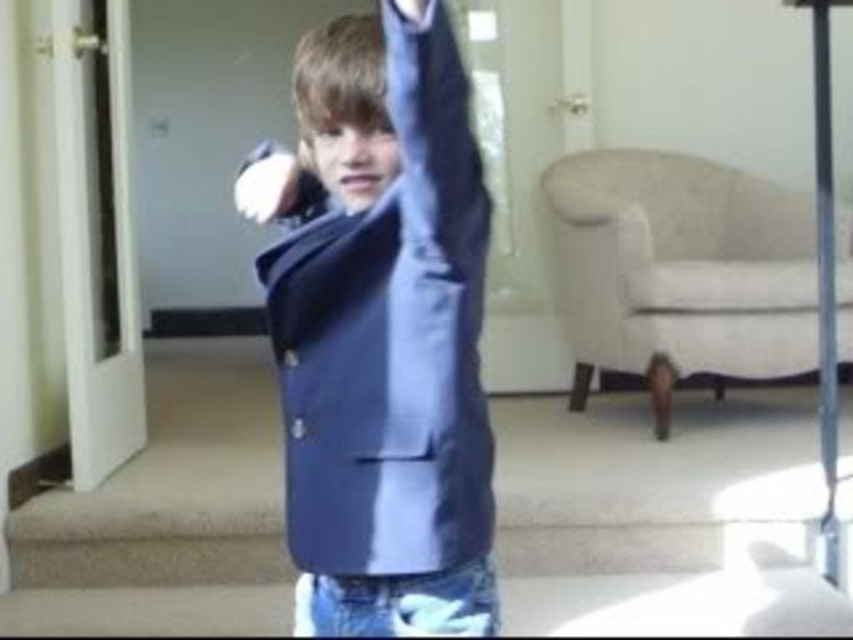
Question: Can you confirm if satin blue blazer at center is positioned above satin blue jacket at center?

Choices:
 (A) no
 (B) yes

Answer: (A)

Question: Which point is closer to the camera?

Choices:
 (A) (361, 20)
 (B) (390, 218)
 (C) (393, 48)

Answer: (C)

Question: Is matte blue blazer at upper center wider than white matte glove at upper center?

Choices:
 (A) yes
 (B) no

Answer: (B)

Question: Which object is positioned farthest from the white matte glove at upper center?

Choices:
 (A) satin blue jacket at center
 (B) matte blue blazer at upper center
 (C) satin blue blazer at upper center
 (D) satin blue blazer at center

Answer: (C)

Question: Does satin blue blazer at center have a lesser width compared to matte blue blazer at upper center?

Choices:
 (A) no
 (B) yes

Answer: (A)

Question: Considering the real-world distances, which object is closest to the matte blue blazer at upper center?

Choices:
 (A) satin blue blazer at center
 (B) satin blue jacket at center
 (C) white matte glove at upper center
 (D) satin blue blazer at upper center

Answer: (B)